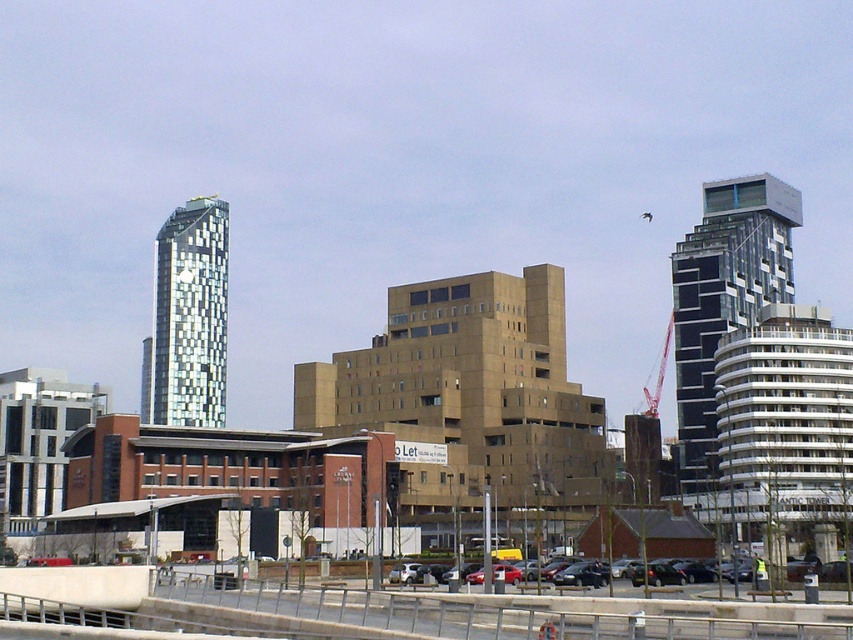
Question: Which object is the closest to the matte red car at center?

Choices:
 (A) metallic silver car at center
 (B) glass mosaic tower at left
 (C) metallic red crane at center right

Answer: (A)

Question: Is the position of glassy black skyscraper at right more distant than that of shiny black sedan at center?

Choices:
 (A) no
 (B) yes

Answer: (B)

Question: Considering the real-world distances, which object is closest to the metallic red crane at center right?

Choices:
 (A) metallic silver car at center
 (B) matte red car at center

Answer: (B)

Question: Is glassy black skyscraper at right closer to the viewer compared to matte red car at center?

Choices:
 (A) no
 (B) yes

Answer: (A)

Question: Is glassy black skyscraper at right to the left of metallic silver car at center from the viewer's perspective?

Choices:
 (A) yes
 (B) no

Answer: (B)

Question: Which object appears closest to the camera in this image?

Choices:
 (A) metallic silver car at center
 (B) glassy black skyscraper at right
 (C) shiny black sedan at center

Answer: (C)